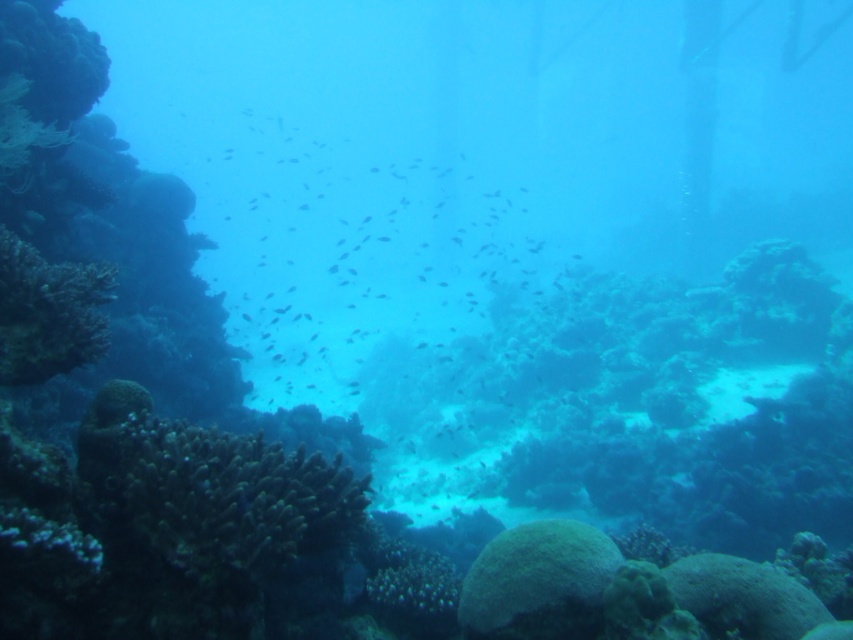
Question: Does dark blue matte fish at center lie in front of green matte coral at lower left?

Choices:
 (A) no
 (B) yes

Answer: (A)

Question: Which of the following is the closest to the observer?

Choices:
 (A) (364, 150)
 (B) (276, 445)

Answer: (B)

Question: Among these objects, which one is nearest to the camera?

Choices:
 (A) dark blue matte fish at center
 (B) green matte coral at lower left

Answer: (B)

Question: Is dark blue matte fish at center to the right of green matte coral at lower left from the viewer's perspective?

Choices:
 (A) yes
 (B) no

Answer: (B)

Question: Does dark blue matte fish at center have a smaller size compared to green matte coral at lower left?

Choices:
 (A) no
 (B) yes

Answer: (A)